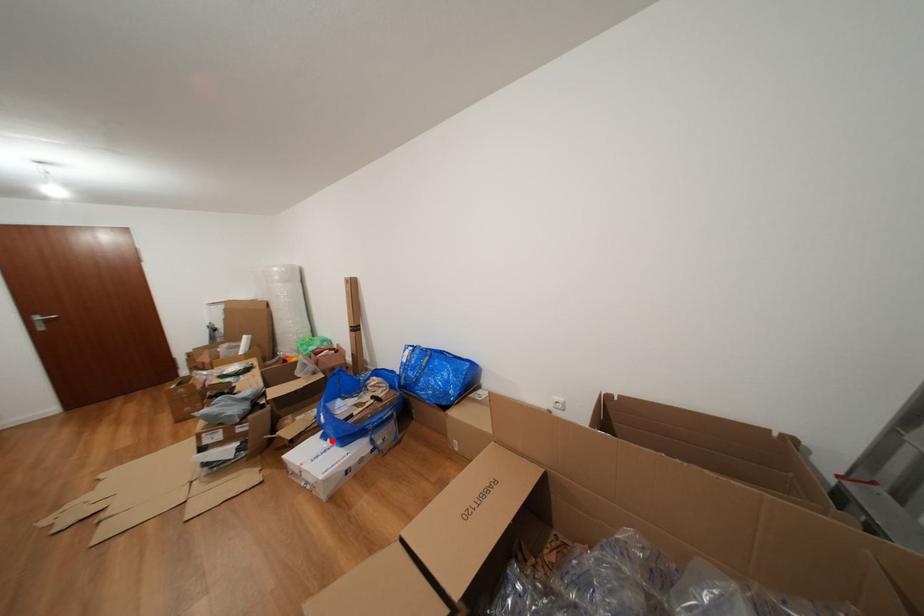
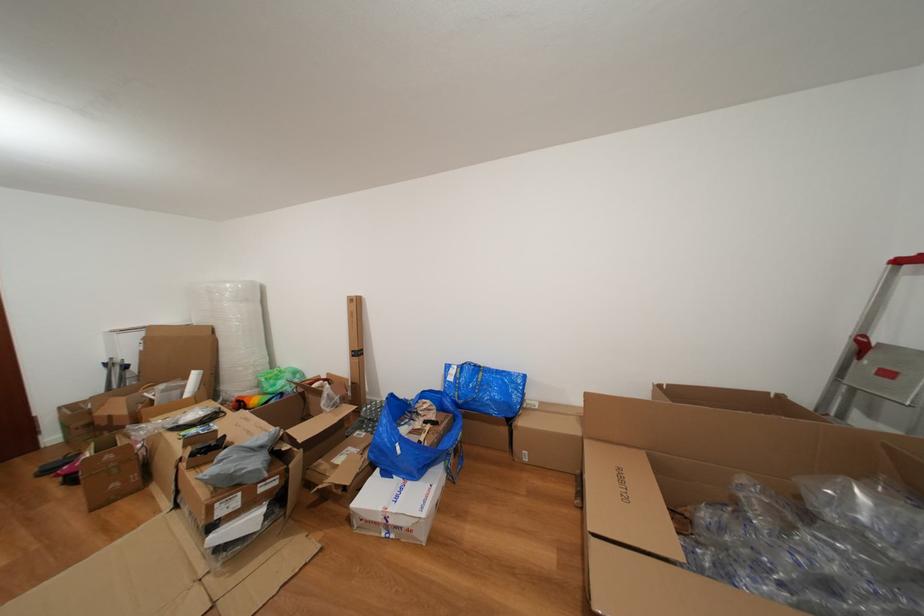
Question: A red point is marked in image1. In image2, is the corresponding 3D point closer to the camera or farther? Reply with the corresponding letter.

Choices:
 (A) The corresponding 3D point is closer.
 (B) The corresponding 3D point is farther.

Answer: (B)